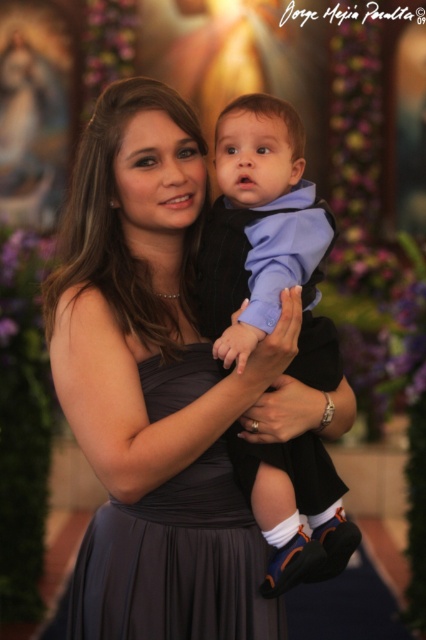
Question: Based on their relative distances, which object is nearer to the dark gray satin dress at center?

Choices:
 (A) matte black vest at center
 (B) matte gray dress at center

Answer: (B)

Question: Estimate the real-world distances between objects in this image. Which object is closer to the matte gray dress at center?

Choices:
 (A) dark gray satin dress at center
 (B) matte black vest at center

Answer: (A)

Question: Is matte gray dress at center further to the viewer compared to matte black vest at center?

Choices:
 (A) no
 (B) yes

Answer: (B)

Question: Observing the image, what is the correct spatial positioning of matte gray dress at center in reference to dark gray satin dress at center?

Choices:
 (A) left
 (B) right

Answer: (B)

Question: Is matte black vest at center to the left of dark gray satin dress at center from the viewer's perspective?

Choices:
 (A) no
 (B) yes

Answer: (A)

Question: Considering the real-world distances, which object is farthest from the dark gray satin dress at center?

Choices:
 (A) matte black vest at center
 (B) matte gray dress at center

Answer: (A)